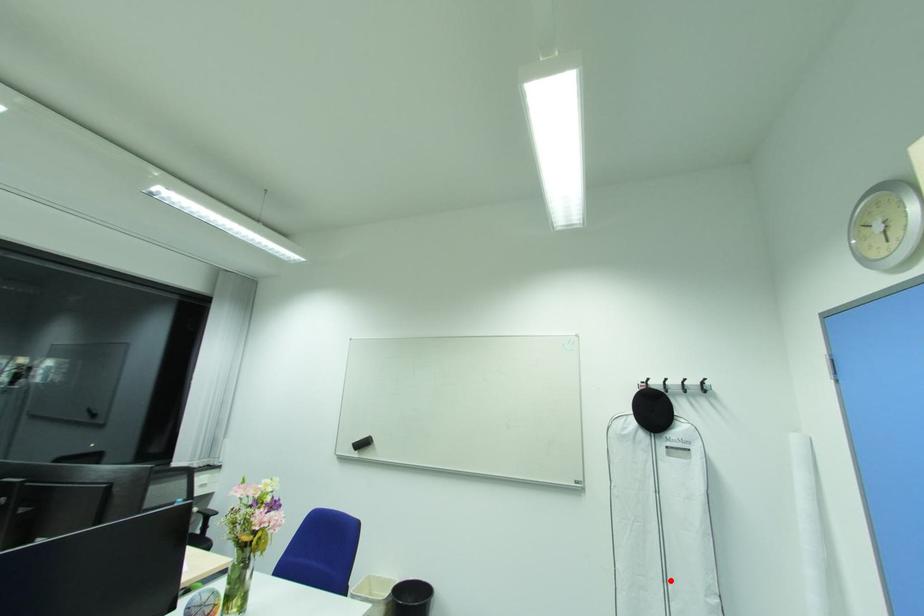
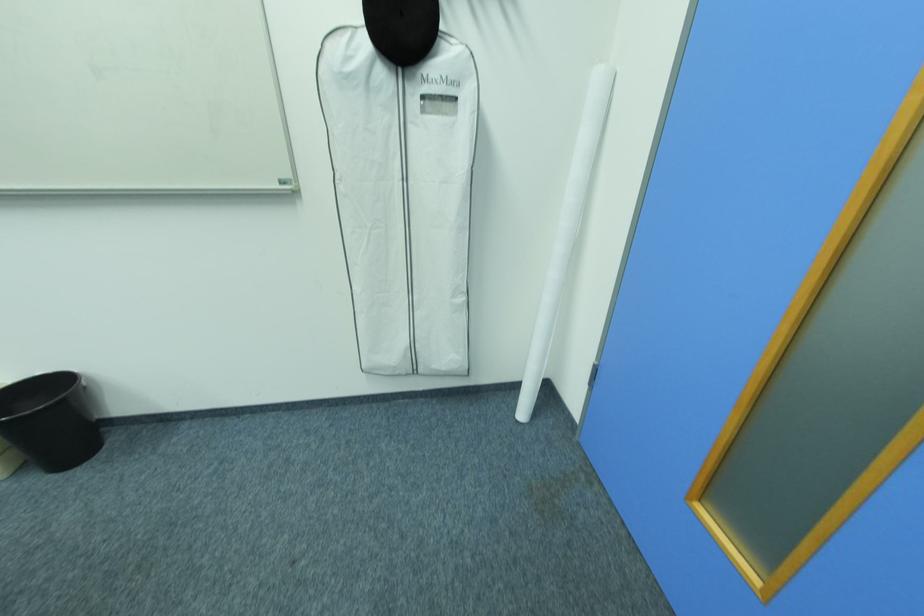
The point at the highlighted location is marked in the first image. Where is the corresponding point in the second image?

(416, 292)